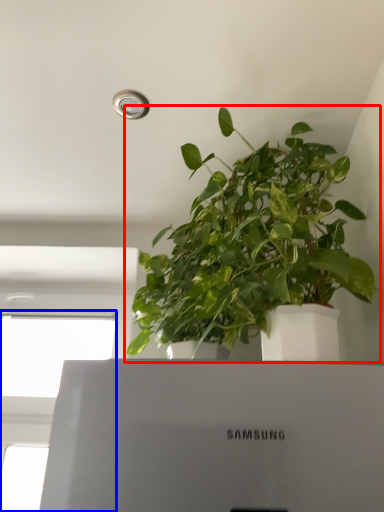
Question: Among these objects, which one is nearest to the camera, houseplant (highlighted by a red box) or window (highlighted by a blue box)?

Choices:
 (A) houseplant
 (B) window

Answer: (B)